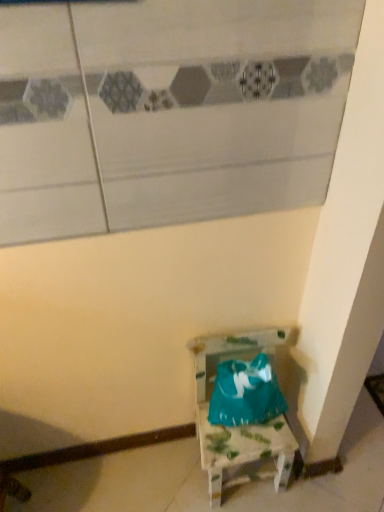
Locate an element on the screen. wooden painted chair at lower right is located at coordinates (242, 425).

Describe the element at coordinates (242, 425) in the screenshot. I see `wooden painted chair at lower right` at that location.

This screenshot has height=512, width=384. Find the location of `wooden painted chair at lower right`. wooden painted chair at lower right is located at coordinates (242, 425).